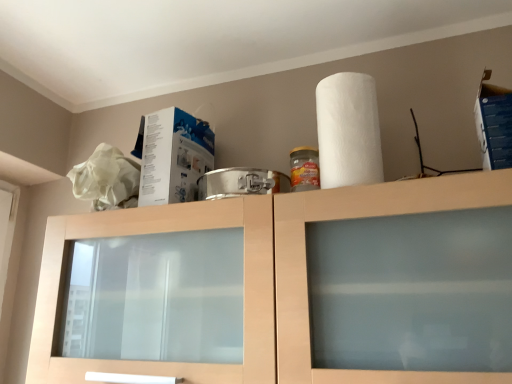
Question: Considering the relative sizes of blue cardboard box at upper right, acting as the 2th box starting from the left, and white textured paper towel at upper right in the image provided, is blue cardboard box at upper right, acting as the 2th box starting from the left, shorter than white textured paper towel at upper right?

Choices:
 (A) yes
 (B) no

Answer: (A)

Question: Is blue cardboard box at upper right, which is the 1th box from right to left, closer to the viewer compared to white textured paper towel at upper right?

Choices:
 (A) no
 (B) yes

Answer: (B)

Question: Is blue cardboard box at upper right, which is the first box from front to back, at the left side of white textured paper towel at upper right?

Choices:
 (A) no
 (B) yes

Answer: (A)

Question: Is white textured paper towel at upper right completely or partially inside blue cardboard box at upper right, acting as the 2th box starting from the left?

Choices:
 (A) yes
 (B) no

Answer: (B)

Question: Can you confirm if blue cardboard box at upper right, acting as the 2th box starting from the left, is positioned to the right of white textured paper towel at upper right?

Choices:
 (A) no
 (B) yes

Answer: (B)

Question: Is point (355, 87) closer or farther from the camera than point (500, 127)?

Choices:
 (A) farther
 (B) closer

Answer: (A)

Question: Is white textured paper towel at upper right inside or outside of blue cardboard box at upper right, which is the first box from front to back?

Choices:
 (A) outside
 (B) inside

Answer: (A)

Question: From the image's perspective, is white textured paper towel at upper right positioned above or below blue cardboard box at upper right, which is the 1th box from right to left?

Choices:
 (A) below
 (B) above

Answer: (A)

Question: In the image, is white textured paper towel at upper right positioned in front of or behind blue cardboard box at upper right, which is the 1th box from right to left?

Choices:
 (A) front
 (B) behind

Answer: (B)

Question: Considering the positions of blue cardboard box at upper right, which is the 1th box from right to left, and white textured paper towel at upper right in the image, is blue cardboard box at upper right, which is the 1th box from right to left, taller or shorter than white textured paper towel at upper right?

Choices:
 (A) short
 (B) tall

Answer: (A)

Question: Is blue cardboard box at upper right, which is the first box from front to back, wider or thinner than white textured paper towel at upper right?

Choices:
 (A) wide
 (B) thin

Answer: (B)

Question: Is point (498, 144) closer or farther from the camera than point (324, 165)?

Choices:
 (A) closer
 (B) farther

Answer: (A)

Question: From the image's perspective, relative to white textured paper towel at upper right, is blue cardboard box at upper right, which is the first box from front to back, above or below?

Choices:
 (A) below
 (B) above

Answer: (B)

Question: Looking at their shapes, would you say white cardboard box at upper left, the first box positioned from the back, is wider or thinner than blue cardboard box at upper right, the 2th box from the back?

Choices:
 (A) thin
 (B) wide

Answer: (B)

Question: Based on their positions, is white cardboard box at upper left, the first box viewed from the left, located to the left or right of blue cardboard box at upper right, which is the 1th box from right to left?

Choices:
 (A) right
 (B) left

Answer: (B)